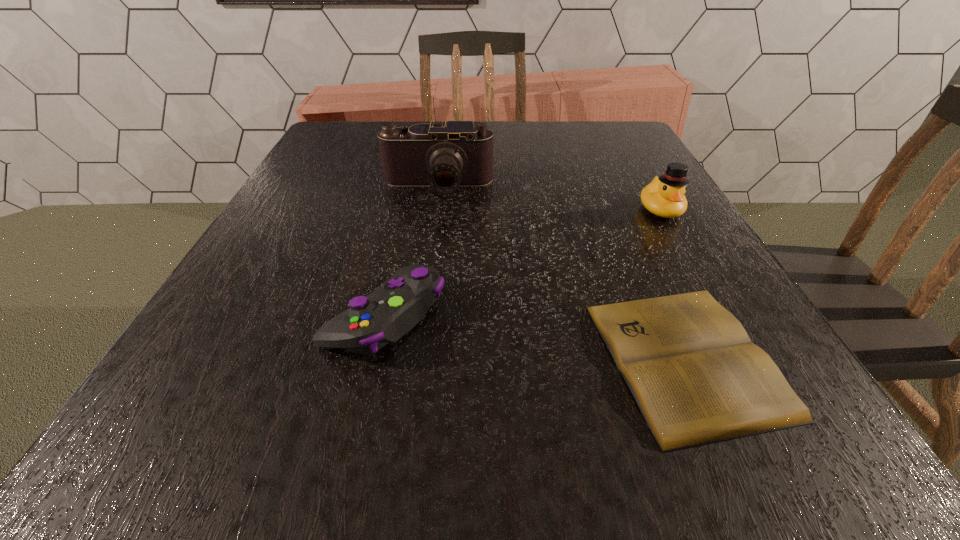
The width and height of the screenshot is (960, 540). Identify the location of free space that is in between the book and the tallest object. (562, 273).

You are a GUI agent. You are given a task and a screenshot of the screen. Output one action in this format:
    pyautogui.click(x=<x>, y=<y>)
    Task: Click on the vacant point located between the second shortest object and the shortest object
    
    Given the screenshot: What is the action you would take?
    pyautogui.click(x=536, y=337)

Image resolution: width=960 pixels, height=540 pixels. In order to click on free spot between the second shortest object and the camera in this screenshot , I will do `click(411, 252)`.

Where is `free spot between the shortest object and the camera`? free spot between the shortest object and the camera is located at coordinates (562, 273).

I want to click on vacant point located between the second shortest object and the tallest object, so click(411, 252).

Find the location of a particular element. This screenshot has width=960, height=540. vacant area between the book and the duck is located at coordinates (673, 284).

Where is `free spot between the second shortest object and the camera`? free spot between the second shortest object and the camera is located at coordinates (411, 252).

Where is `free space between the tallest object and the second shortest object`? The height and width of the screenshot is (540, 960). free space between the tallest object and the second shortest object is located at coordinates (411, 252).

This screenshot has width=960, height=540. I want to click on vacant space in between the second tallest object and the second shortest object, so (x=522, y=262).

You are a GUI agent. You are given a task and a screenshot of the screen. Output one action in this format:
    pyautogui.click(x=<x>, y=<y>)
    Task: Click on the third closest object to the tallest object
    The image size is (960, 540).
    Given the screenshot: What is the action you would take?
    pyautogui.click(x=697, y=378)